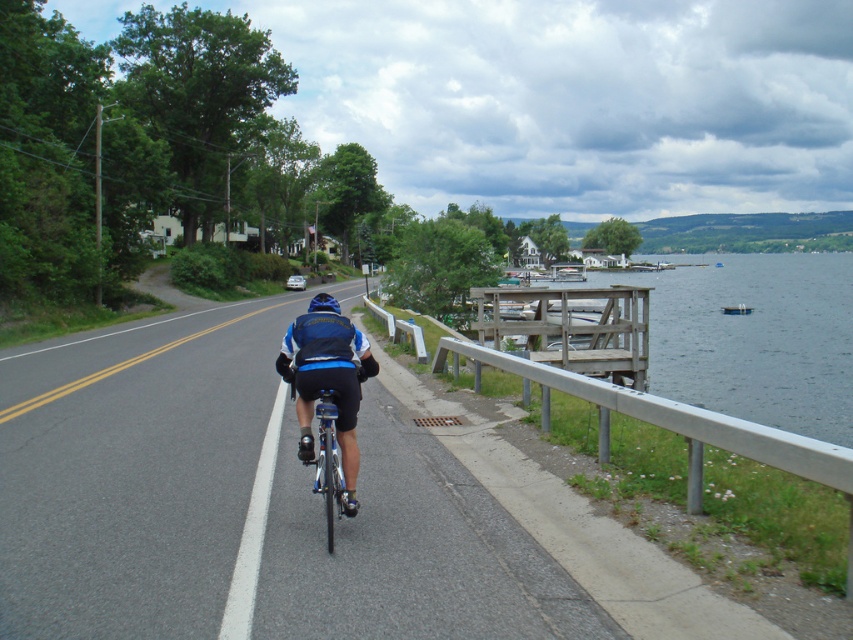
Based on the photo, is blue matte bicycle at center closer to camera compared to blue matte helmet at center?

Yes, blue matte bicycle at center is closer to the viewer.

Between point (345, 420) and point (329, 308), which one is positioned in front?

Point (345, 420) is in front.

Which is behind, point (325, 324) or point (331, 300)?

Point (331, 300)

Identify the location of blue matte bicycle at center. The height and width of the screenshot is (640, 853). (328, 381).

Between gray metallic rail at lower right and blue matte bicycle at center, which one appears on the right side from the viewer's perspective?

Positioned to the right is gray metallic rail at lower right.

Can you confirm if gray metallic rail at lower right is positioned below blue matte bicycle at center?

Yes.

Which is in front, point (560, 371) or point (344, 339)?

Point (344, 339) is more forward.

The width and height of the screenshot is (853, 640). Identify the location of gray metallic rail at lower right. (682, 420).

Is gray asphalt bike lane at center taller than gray metallic rail at lower right?

Yes, gray asphalt bike lane at center is taller than gray metallic rail at lower right.

Consider the image. Measure the distance from gray asphalt bike lane at center to gray metallic rail at lower right.

13.53 feet

Is point (254, 452) farther from viewer compared to point (531, 365)?

No, (254, 452) is closer to viewer.

Where is `gray asphalt bike lane at center`? gray asphalt bike lane at center is located at coordinates (241, 500).